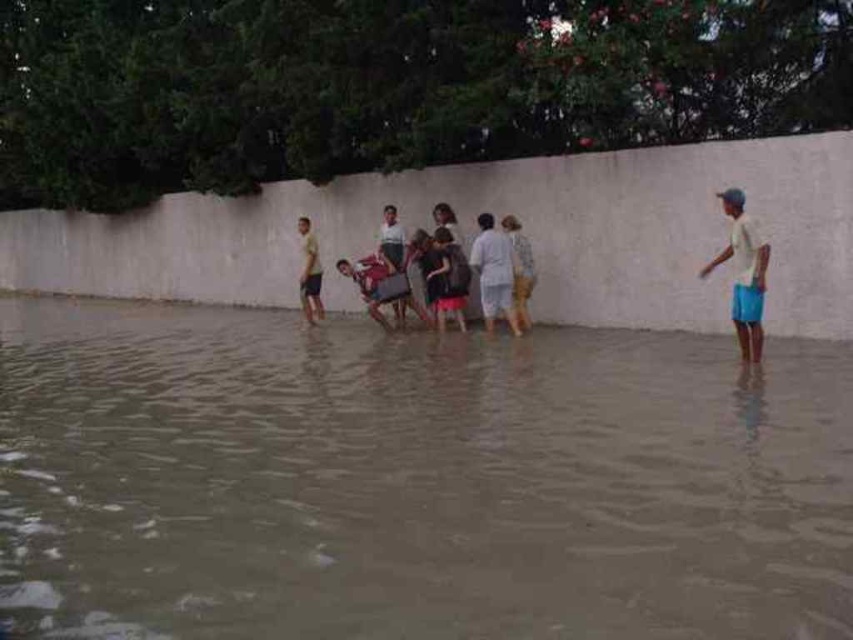
You are a photographer trying to capture the white cotton shirt at right in the scene. Based on its position, where should you aim your camera to ensure it is centered in the frame?

The white cotton shirt at right is located at point 0.430 on the x axis and 0.872 on the y axis. To center it in the frame, aim your camera at those coordinates.

You are a photographer trying to capture a photo of both the white cotton shirt at right and the white cotton shirt at center. The camera you have can only focus on objects within a 3 meter range. Will you be able to include both shirts in the same focused shot?

The white cotton shirt at right is 3.75 meters away from the white cotton shirt at center. Since the distance between them is greater than the camera can focus within 3 meters, you won that both shirts can be in focus simultaneously.